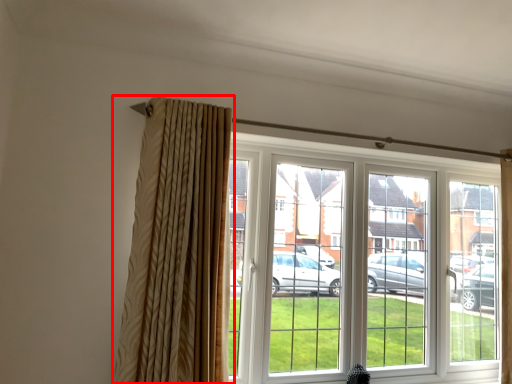
Question: In this image, where is curtain (annotated by the red box) located relative to window?

Choices:
 (A) left
 (B) right

Answer: (A)